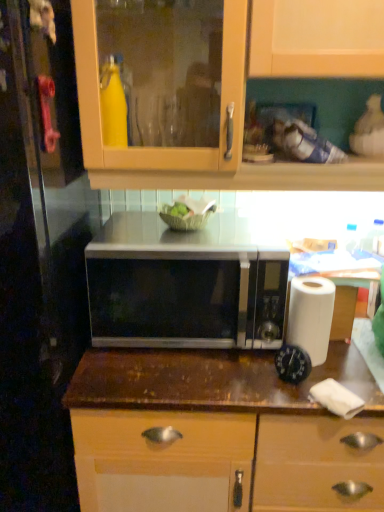
Question: Considering the relative positions of satin silver microwave at center and white paper towel at lower right in the image provided, is satin silver microwave at center to the left of white paper towel at lower right from the viewer's perspective?

Choices:
 (A) no
 (B) yes

Answer: (B)

Question: Is satin silver microwave at center at the right side of white paper towel at lower right?

Choices:
 (A) yes
 (B) no

Answer: (B)

Question: Is satin silver microwave at center next to white paper towel at lower right?

Choices:
 (A) yes
 (B) no

Answer: (B)

Question: From the image's perspective, would you say satin silver microwave at center is positioned over white paper towel at lower right?

Choices:
 (A) yes
 (B) no

Answer: (A)

Question: From a real-world perspective, is satin silver microwave at center over white paper towel at lower right?

Choices:
 (A) yes
 (B) no

Answer: (A)

Question: Do you think transparent glass door at left is within white paper at right, or outside of it?

Choices:
 (A) inside
 (B) outside

Answer: (B)

Question: From their relative heights in the image, would you say transparent glass door at left is taller or shorter than white paper at right?

Choices:
 (A) tall
 (B) short

Answer: (A)

Question: From a real-world perspective, is transparent glass door at left above or below white paper at right?

Choices:
 (A) above
 (B) below

Answer: (B)

Question: From the image's perspective, is transparent glass door at left above or below white paper at right?

Choices:
 (A) above
 (B) below

Answer: (B)

Question: In terms of size, does satin silver microwave at center appear bigger or smaller than brown wood countertop at center?

Choices:
 (A) small
 (B) big

Answer: (A)

Question: From the image's perspective, relative to brown wood countertop at center, is satin silver microwave at center above or below?

Choices:
 (A) below
 (B) above

Answer: (B)

Question: From a real-world perspective, is satin silver microwave at center physically located above or below brown wood countertop at center?

Choices:
 (A) above
 (B) below

Answer: (A)

Question: Is point (147, 325) closer or farther from the camera than point (87, 362)?

Choices:
 (A) closer
 (B) farther

Answer: (B)

Question: In the image, is satin silver microwave at center on the left side or the right side of white paper at right?

Choices:
 (A) left
 (B) right

Answer: (A)

Question: From the image's perspective, relative to white paper at right, is satin silver microwave at center above or below?

Choices:
 (A) above
 (B) below

Answer: (A)